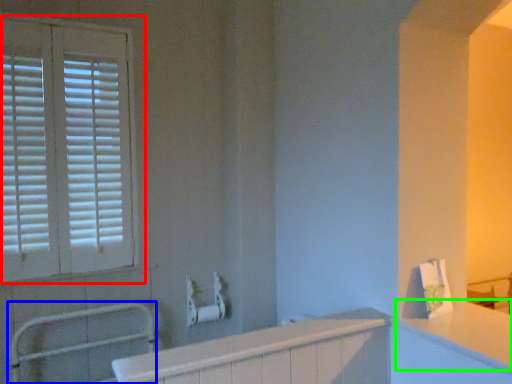
Question: Considering the real-world distances, which object is farthest from window (highlighted by a red box)? balustrade (highlighted by a blue box) or counter top (highlighted by a green box)?

Choices:
 (A) balustrade
 (B) counter top

Answer: (B)